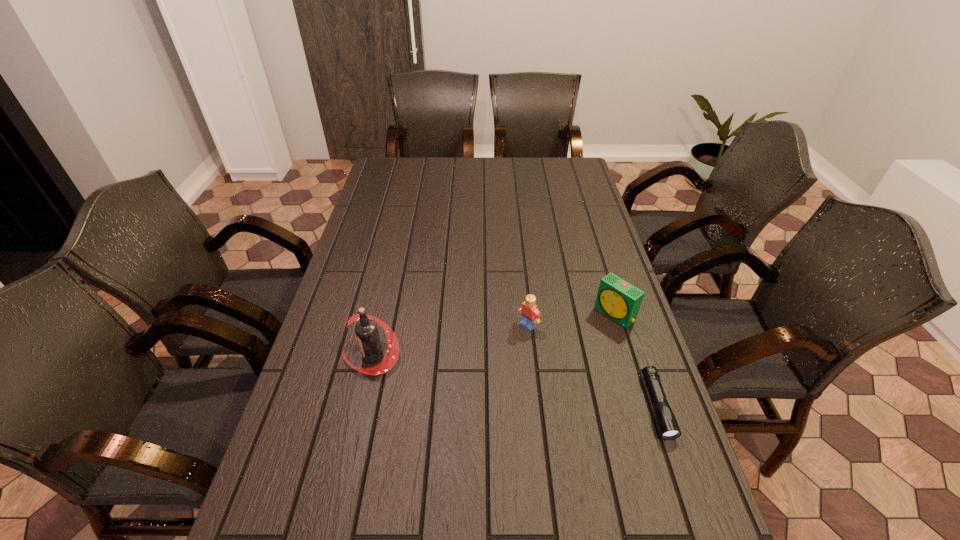
Where is `free space on the desktop that is between the root beer and the shortest object and is positioned on the front-facing side of the alarm clock`? free space on the desktop that is between the root beer and the shortest object and is positioned on the front-facing side of the alarm clock is located at coordinates (528, 383).

Identify the location of free space on the desktop that is between the root beer and the flashlight and is positioned on the front-facing side of the Lego. This screenshot has width=960, height=540. (468, 373).